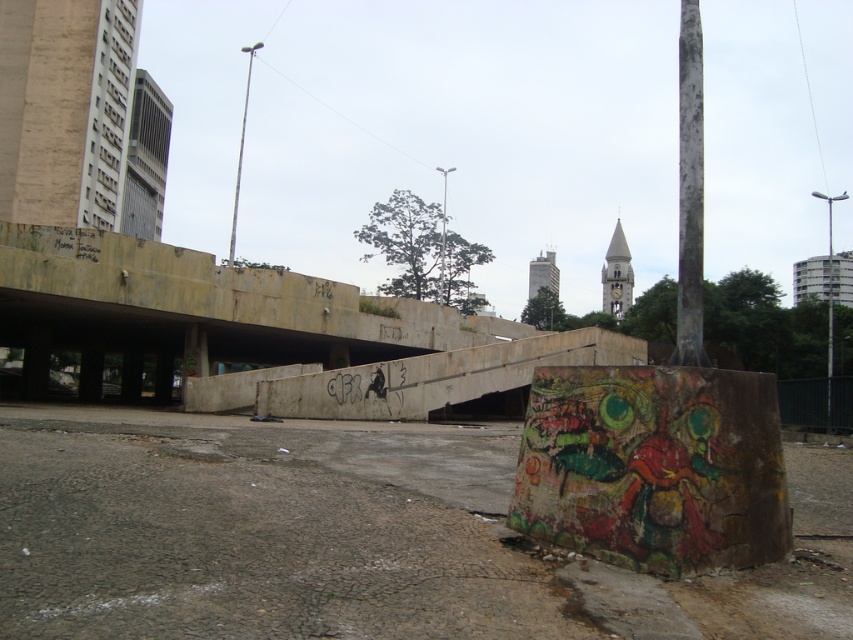
Question: Does white weathered pole at right have a smaller size compared to silver metallic pole at upper center?

Choices:
 (A) yes
 (B) no

Answer: (B)

Question: Can you confirm if white weathered pole at right is smaller than gray concrete building at upper left?

Choices:
 (A) no
 (B) yes

Answer: (A)

Question: Is beige stone building at upper left bigger than gray concrete tower at center?

Choices:
 (A) yes
 (B) no

Answer: (B)

Question: Which point is farther to the camera?

Choices:
 (A) (543, 268)
 (B) (144, 88)
 (C) (677, 262)

Answer: (A)

Question: Based on their relative distances, which object is nearer to the white weathered pole at right?

Choices:
 (A) silver metallic pole at upper center
 (B) gray concrete tower at center
 (C) beige stone building at upper left
 (D) white stone clock tower at upper center

Answer: (D)

Question: Which of these objects is positioned farthest from the silver metallic pole at upper center?

Choices:
 (A) white stone clock tower at upper center
 (B) white plastic pole at center
 (C) gray concrete building at upper left
 (D) gray concrete tower at center

Answer: (D)